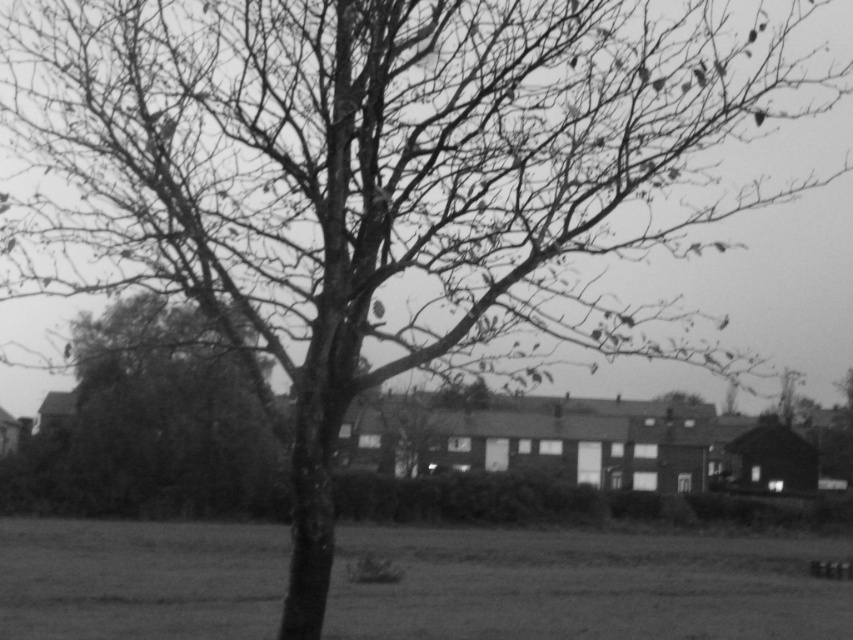
You are standing in the middle of the grassy plain at lower center and want to walk towards the smooth bark tree at center. Which direction should you head?

The grassy plain at lower center is to the right of the smooth bark tree at center, so to walk towards the smooth bark tree at center, you should head to the left.

You are a landscape architect designing a walking path between the grassy plain at lower center and the smooth bark tree at center. What is the minimum width the path must be to ensure a 1.5 meter buffer on both sides of the path?

The path must be at least 3 meters wide to accommodate a 1.5 meter buffer on both sides, ensuring the path is 3 meters wide in total.